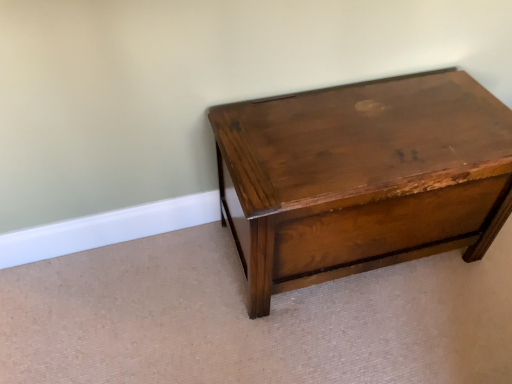
Image resolution: width=512 pixels, height=384 pixels. Find the location of `vacant space to the left of shiny brown wood chest at center`. vacant space to the left of shiny brown wood chest at center is located at coordinates (161, 300).